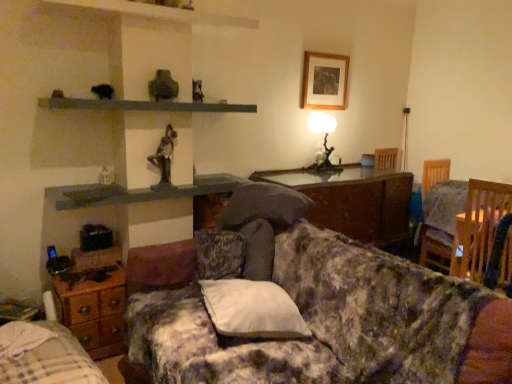
Question: From a real-world perspective, relative to wooden picture frame at upper center, is wooden bed frame at lower left vertically above or below?

Choices:
 (A) below
 (B) above

Answer: (A)

Question: Looking at the image, does wooden bed frame at lower left seem bigger or smaller compared to wooden picture frame at upper center?

Choices:
 (A) small
 (B) big

Answer: (B)

Question: Which is nearer to the floral fabric couch at center?

Choices:
 (A) wooden bed frame at lower left
 (B) matte black table lamp at upper center
 (C) smooth gray shelf at upper center
 (D) brown wood cabinet at center
 (E) wooden chair at right, marked as the second table in a back-to-front arrangement

Answer: (A)

Question: Estimate the real-world distances between objects in this image. Which object is farther from the white soft pillow at center?

Choices:
 (A) wooden chair at right
 (B) wooden chair at right, marked as the 2th table in a left-to-right arrangement
 (C) bronze statue at center
 (D) wooden drawer at lower left, arranged as the second table when viewed from the top
 (E) matte black table lamp at upper center

Answer: (E)